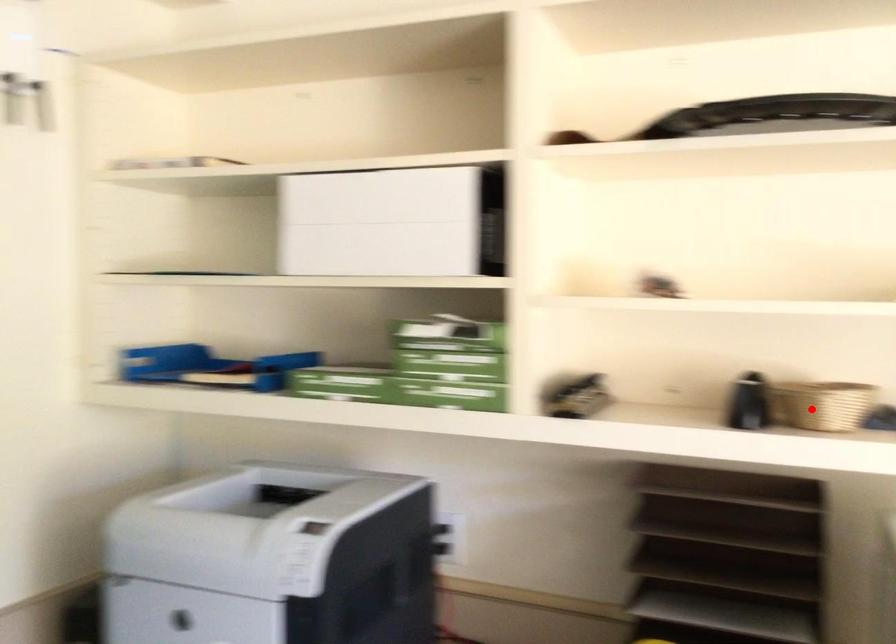
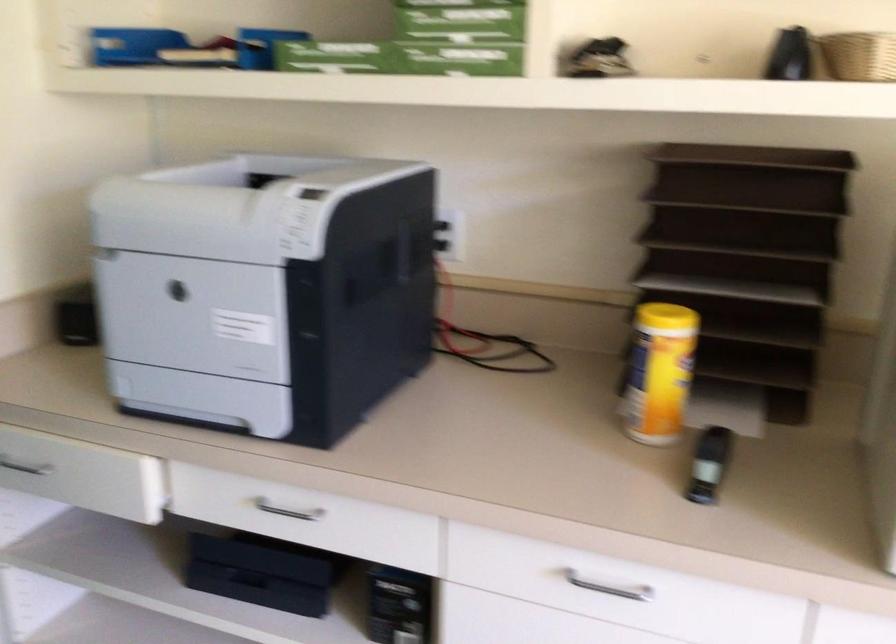
Where in the second image is the point corresponding to the highlighted location from the first image?

(858, 55)